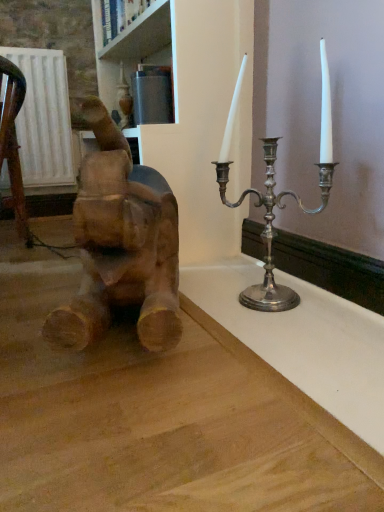
Question: Considering the positions of wooden elephant at left and white painted wood at upper center in the image, is wooden elephant at left taller or shorter than white painted wood at upper center?

Choices:
 (A) tall
 (B) short

Answer: (A)

Question: Looking at their shapes, would you say wooden elephant at left is wider or thinner than white painted wood at upper center?

Choices:
 (A) thin
 (B) wide

Answer: (B)

Question: Is wooden elephant at left inside the boundaries of white painted wood at upper center, or outside?

Choices:
 (A) outside
 (B) inside

Answer: (A)

Question: From a real-world perspective, is white painted wood at upper center physically located above or below wooden elephant at left?

Choices:
 (A) below
 (B) above

Answer: (B)

Question: Visually, is white painted wood at upper center positioned to the left or to the right of wooden elephant at left?

Choices:
 (A) left
 (B) right

Answer: (A)

Question: Looking at the image, does white painted wood at upper center seem bigger or smaller compared to wooden elephant at left?

Choices:
 (A) small
 (B) big

Answer: (A)

Question: From the image's perspective, is white painted wood at upper center positioned above or below wooden elephant at left?

Choices:
 (A) above
 (B) below

Answer: (A)